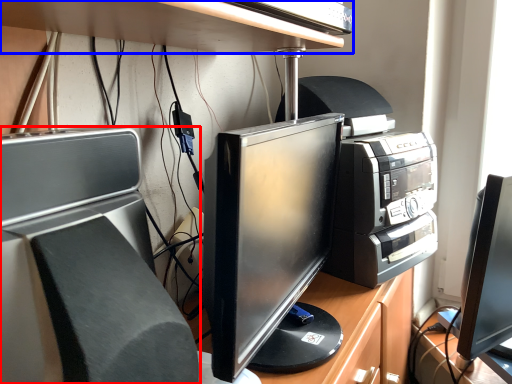
Question: Which of the following is the closest to the observer, home appliance (highlighted by a red box) or desk (highlighted by a blue box)?

Choices:
 (A) home appliance
 (B) desk

Answer: (A)